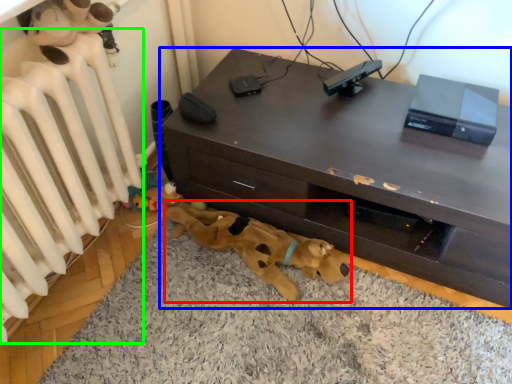
Question: Which object is the farthest from toy (highlighted by a red box)? Choose among these: desk (highlighted by a blue box) or radiator (highlighted by a green box).

Choices:
 (A) desk
 (B) radiator

Answer: (B)